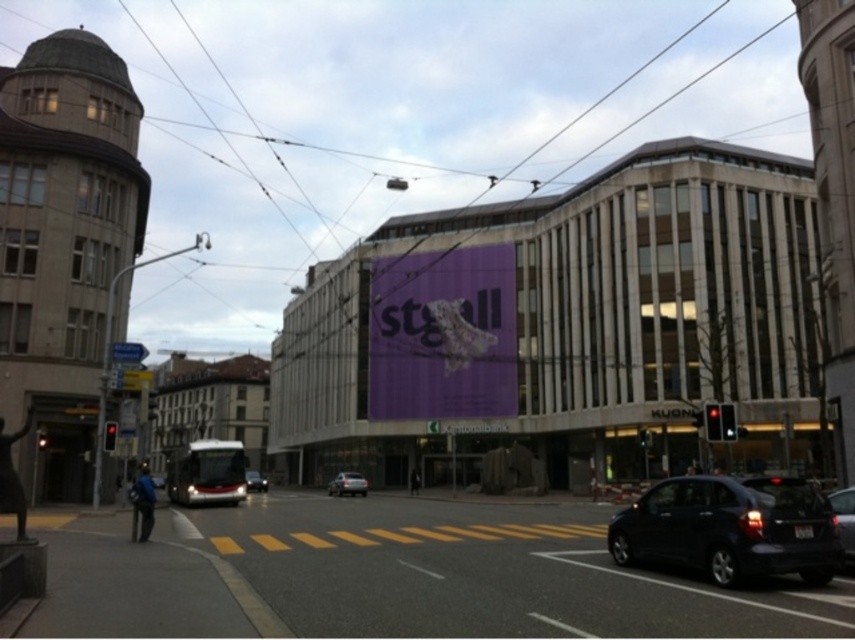
Is shiny black sedan at lower right above shiny silver bus at center?

Indeed, shiny black sedan at lower right is positioned over shiny silver bus at center.

Does shiny black sedan at lower right lie in front of shiny silver bus at center?

Yes.

This screenshot has height=640, width=855. What do you see at coordinates (730, 529) in the screenshot? I see `shiny black sedan at lower right` at bounding box center [730, 529].

What are the coordinates of `shiny black sedan at lower right` in the screenshot? It's located at (730, 529).

Between point (730, 584) and point (851, 548), which one is positioned behind?

Positioned behind is point (851, 548).

Looking at this image, who is lower down, shiny black sedan at lower right or shiny black car at lower right?

Positioned lower is shiny black car at lower right.

Who is more distant from viewer, (808, 492) or (847, 561)?

The point (847, 561) is behind.

At what (x,y) coordinates should I click in order to perform the action: click on shiny black sedan at lower right. Please return your answer as a coordinate pair (x, y). Looking at the image, I should click on (730, 529).

Does point (405, 305) come closer to viewer compared to point (266, 488)?

No, it is not.

Does purple matte billboard at center have a larger size compared to shiny silver bus at center?

Actually, purple matte billboard at center might be smaller than shiny silver bus at center.

Where is `purple matte billboard at center`? purple matte billboard at center is located at coordinates (441, 333).

The image size is (855, 640). What are the coordinates of `purple matte billboard at center` in the screenshot? It's located at (441, 333).